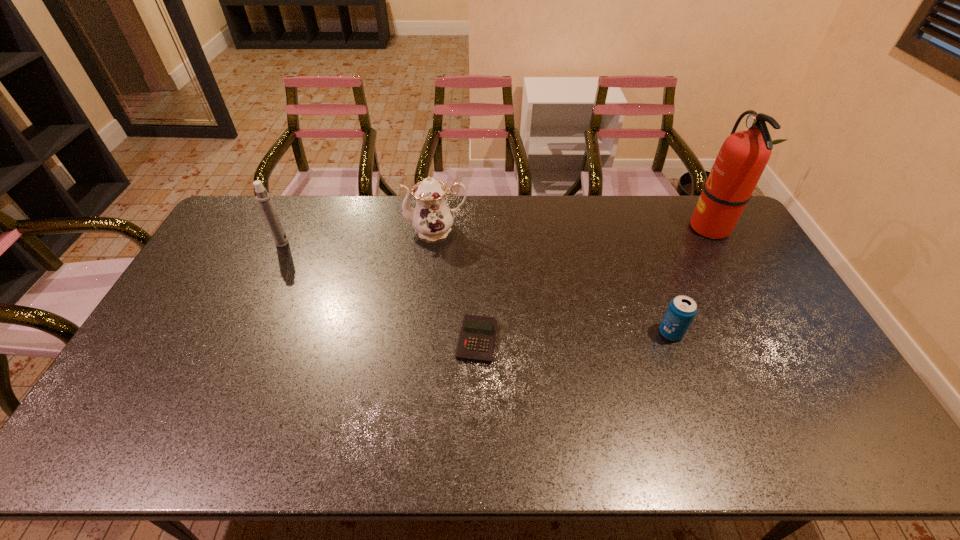
Where is `free region located on the right of the leftmost object`? free region located on the right of the leftmost object is located at coordinates (394, 243).

This screenshot has height=540, width=960. Find the location of `free space located 0.070m on the front of the chinaware`. free space located 0.070m on the front of the chinaware is located at coordinates (433, 258).

Identify the location of vacant space positioned on the front of the fourth tallest object. (682, 361).

Locate an element on the screen. free space located on the left of the shortest object is located at coordinates (351, 340).

I want to click on fire extinguisher positioned at the far edge, so point(744,155).

This screenshot has height=540, width=960. What are the coordinates of `chinaware that is at the far edge` in the screenshot? It's located at (432, 218).

Locate an element on the screen. object that is at the right edge is located at coordinates (744, 155).

At what (x,y) coordinates should I click in order to perform the action: click on object that is at the far right corner. Please return your answer as a coordinate pair (x, y). Looking at the image, I should click on (744, 155).

Locate an element on the screen. vacant space at the far edge of the desktop is located at coordinates tap(567, 206).

Find the location of a particular element. Image resolution: width=960 pixels, height=540 pixels. free space at the near edge of the desktop is located at coordinates (269, 430).